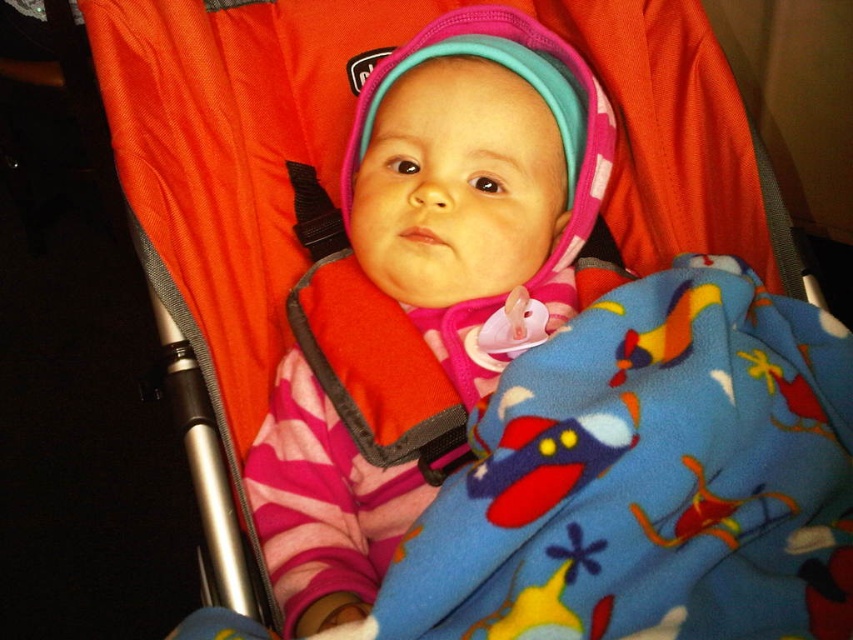
You are a photographer trying to focus on two points in the image. The first point is at coordinate point(492, 525) and the second is at point(386, 116). Which point is nearer to you?

Point(492, 525) is closer to the viewer than point(386, 116).

In the scene shown: You are a photographer trying to capture a closeup of the pink fleece baby at center. However, the blue fleece blanket at center is blocking your view. Can you adjust your position to see the baby without moving the blanket?

The blue fleece blanket at center is in front of the pink fleece baby at center, so you need to move the blanket aside or adjust your angle to see the baby behind it.

You are a photographer trying to capture a closeup of the baby in the stroller. The camera is positioned at the current viewpoint. Can you confirm if the blue fleece blanket at center is within the camera focus range of 20 inches?

The blue fleece blanket at center is 21.71 inches away from the camera, which is slightly beyond the 20 inches focus range. Therefore, the camera may not be able to focus on the blue fleece blanket at center clearly unless adjusted.